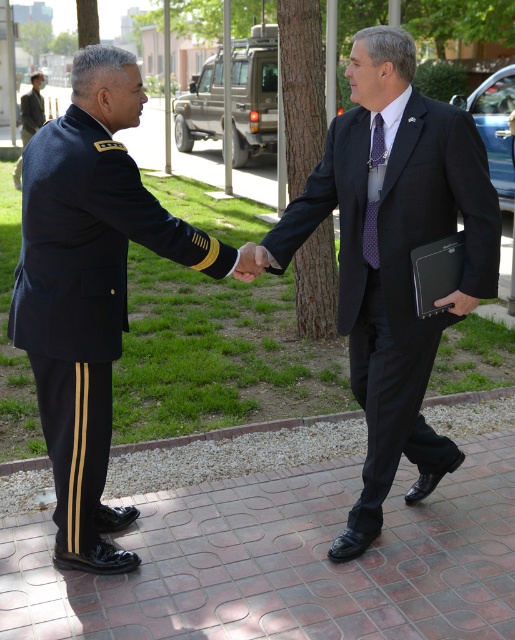
Between purple dotted tie at center and camouflage uniform at upper left, which one is positioned higher?

Positioned higher is camouflage uniform at upper left.

Is point (374, 118) closer to camera compared to point (27, 134)?

That is True.

Who is more forward, [375,234] or [22,115]?

Positioned in front is point [375,234].

The width and height of the screenshot is (515, 640). In order to click on purple dotted tie at center in this screenshot , I will do `click(370, 230)`.

Which of these two, brick pavement at center or purple dotted tie at center, stands taller?

With more height is purple dotted tie at center.

Which is behind, point (449, 492) or point (374, 224)?

Positioned behind is point (449, 492).

This screenshot has width=515, height=640. Find the location of `brick pavement at center`. brick pavement at center is located at coordinates (284, 561).

Can you confirm if navy blue uniform at center is bigger than camouflage uniform at upper left?

No.

What do you see at coordinates (91, 289) in the screenshot?
I see `navy blue uniform at center` at bounding box center [91, 289].

The image size is (515, 640). Identify the location of navy blue uniform at center. (91, 289).